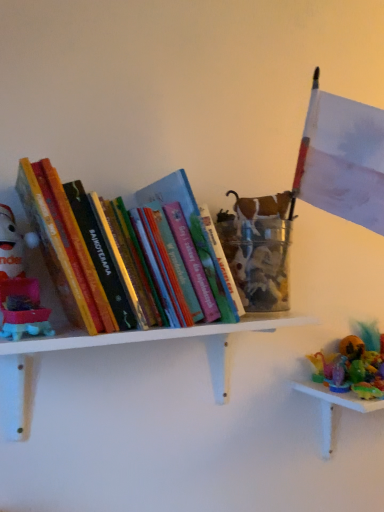
Measure the distance between point (72, 285) and camera.

The depth of point (72, 285) is 22.91 inches.

What is the approximate width of hardcover books at left?

It is 9.32 inches.

The height and width of the screenshot is (512, 384). I want to click on white matte shelf at upper left, so click(x=128, y=343).

Measure the distance between point (17, 293) and camera.

60.30 centimeters.

You are a GUI agent. You are given a task and a screenshot of the screen. Output one action in this format:
    pyautogui.click(x=<x>, y=<y>)
    Task: Click on the hardcover books at left
    The width and height of the screenshot is (384, 512).
    Given the screenshot: What is the action you would take?
    pyautogui.click(x=80, y=250)

Considering the positions of point (307, 383) and point (132, 337), is point (307, 383) closer or farther from the camera than point (132, 337)?

Point (307, 383) is positioned farther from the camera compared to point (132, 337).

From the image's perspective, is translucent plastic toys at lower right above or below white matte shelf at upper left?

Clearly, from the image's perspective, translucent plastic toys at lower right is below white matte shelf at upper left.

Does translucent plastic toys at lower right have a larger size compared to white matte shelf at upper left?

Actually, translucent plastic toys at lower right might be smaller than white matte shelf at upper left.

Can you confirm if plush red santa at left is wider than white matte shelf at upper left?

No.

Considering the relative positions of plush red santa at left and white matte shelf at upper left in the image provided, is plush red santa at left to the left of white matte shelf at upper left from the viewer's perspective?

Yes.

Does point (37, 311) appear closer or farther from the camera than point (7, 411)?

Point (37, 311) is closer to the camera than point (7, 411).

Between plush red santa at left and white matte shelf at upper left, which one has less height?

With less height is white matte shelf at upper left.

Can you confirm if white matte shelf at upper left is shorter than translucent plastic toys at lower right?

Indeed, white matte shelf at upper left has a lesser height compared to translucent plastic toys at lower right.

Can translucent plastic toys at lower right be found inside white matte shelf at upper left?

No, translucent plastic toys at lower right is located outside of white matte shelf at upper left.

Which of these two, white matte shelf at upper left or translucent plastic toys at lower right, is bigger?

With larger size is white matte shelf at upper left.

Is white matte shelf at upper left turned away from translucent plastic toys at lower right?

That's not correct — white matte shelf at upper left is not looking away from translucent plastic toys at lower right.

From a real-world perspective, which is physically above, plush red santa at left or translucent plastic toys at lower right?

plush red santa at left, from a real-world perspective.

How different are the orientations of plush red santa at left and translucent plastic toys at lower right in degrees?

There is a 0.00122-degree angle between the facing directions of plush red santa at left and translucent plastic toys at lower right.

Between plush red santa at left and translucent plastic toys at lower right, which one has smaller width?

plush red santa at left.

Is plush red santa at left inside or outside of translucent plastic toys at lower right?

plush red santa at left is outside translucent plastic toys at lower right.

Where is `toy below the hardcover books at left (from a real-world perspective)`? The width and height of the screenshot is (384, 512). toy below the hardcover books at left (from a real-world perspective) is located at coordinates (19, 284).

Does hardcover books at left have a greater width compared to plush red santa at left?

Yes.

Can you confirm if hardcover books at left is shorter than plush red santa at left?

In fact, hardcover books at left may be taller than plush red santa at left.

Considering the positions of objects hardcover books at left and plush red santa at left in the image provided, who is more to the right, hardcover books at left or plush red santa at left?

hardcover books at left.

Is plush red santa at left wider or thinner than hardcover books at left?

Clearly, plush red santa at left has less width compared to hardcover books at left.

Is plush red santa at left closer to camera compared to hardcover books at left?

No, it is behind hardcover books at left.

Considering the relative sizes of plush red santa at left and hardcover books at left in the image provided, is plush red santa at left shorter than hardcover books at left?

Correct, plush red santa at left is not as tall as hardcover books at left.

Is point (2, 273) closer to viewer compared to point (74, 291)?

That is False.

From the picture: Does white matte shelf at upper left have a smaller size compared to hardcover books at left?

Correct, white matte shelf at upper left occupies less space than hardcover books at left.

Would you say white matte shelf at upper left is a long distance from hardcover books at left?

That's not correct — white matte shelf at upper left is a little close to hardcover books at left.

Which is correct: white matte shelf at upper left is inside hardcover books at left, or outside of it?

white matte shelf at upper left is not inside hardcover books at left, it's outside.

I want to click on shelf lying in front of the translucent plastic toys at lower right, so click(128, 343).

Find the location of a particular element. toy above the white matte shelf at upper left (from a real-world perspective) is located at coordinates (19, 284).

When comparing their distances from translucent plastic toys at lower right, does white matte shelf at upper left or plush red santa at left seem closer?

white matte shelf at upper left.

Considering their positions, is hardcover books at left positioned closer to plush red santa at left than white matte shelf at upper left?

Based on the image, hardcover books at left appears to be nearer to plush red santa at left.

Estimate the real-world distances between objects in this image. Which object is closer to hardcover books at left, white matte shelf at upper left or plush red santa at left?

plush red santa at left lies closer to hardcover books at left than the other object.

Looking at the image, which one is located further to hardcover books at left, plush red santa at left or translucent plastic toys at lower right?

translucent plastic toys at lower right.

Looking at the image, which one is located closer to white matte shelf at upper left, translucent plastic toys at lower right or plush red santa at left?

plush red santa at left is closer to white matte shelf at upper left.

Estimate the real-world distances between objects in this image. Which object is closer to hardcover books at left, plush red santa at left or white matte shelf at upper left?

plush red santa at left is positioned closer to the anchor hardcover books at left.

Considering their positions, is hardcover books at left positioned further to translucent plastic toys at lower right than plush red santa at left?

The object further to translucent plastic toys at lower right is plush red santa at left.

Estimate the real-world distances between objects in this image. Which object is further from white matte shelf at upper left, plush red santa at left or hardcover books at left?

Among the two, plush red santa at left is located further to white matte shelf at upper left.

Where is `shelf between hardcover books at left and translucent plastic toys at lower right from left to right`? shelf between hardcover books at left and translucent plastic toys at lower right from left to right is located at coordinates (128, 343).

This screenshot has width=384, height=512. In order to click on book situated between plush red santa at left and white matte shelf at upper left from left to right in this screenshot , I will do `click(80, 250)`.

You are a GUI agent. You are given a task and a screenshot of the screen. Output one action in this format:
    pyautogui.click(x=<x>, y=<y>)
    Task: Click on the shelf between plush red santa at left and translucent plastic toys at lower right in the horizontal direction
    
    Given the screenshot: What is the action you would take?
    pyautogui.click(x=128, y=343)

This screenshot has height=512, width=384. Find the location of `book located between plush red santa at left and translucent plastic toys at lower right in the left-right direction`. book located between plush red santa at left and translucent plastic toys at lower right in the left-right direction is located at coordinates (80, 250).